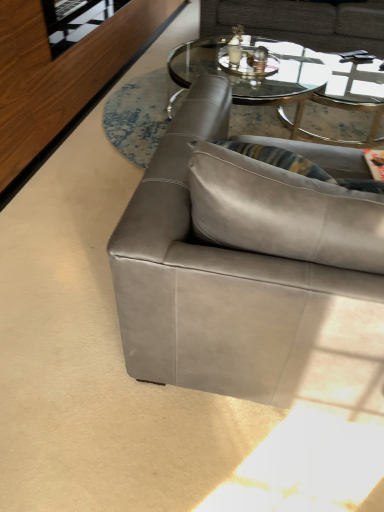
Question: Based on their sizes in the image, would you say gray leather couch at upper center, acting as the second studio couch starting from the front, is bigger or smaller than transparent glass door at upper left?

Choices:
 (A) big
 (B) small

Answer: (A)

Question: From the image's perspective, is gray leather couch at upper center, the first studio couch positioned from the back, positioned above or below transparent glass door at upper left?

Choices:
 (A) above
 (B) below

Answer: (A)

Question: Based on their relative distances, which object is nearer to the transparent glass door at upper left?

Choices:
 (A) suede gray couch at center, the 2th studio couch when ordered from back to front
 (B) gray leather couch at upper center, placed as the 1th studio couch when sorted from top to bottom
 (C) transparent glass coffee table at center

Answer: (C)

Question: Which of these objects is positioned closest to the gray leather couch at upper center, which appears as the second studio couch when ordered from the bottom?

Choices:
 (A) transparent glass coffee table at center
 (B) suede gray couch at center, arranged as the first studio couch when ordered from the bottom
 (C) transparent glass door at upper left

Answer: (A)